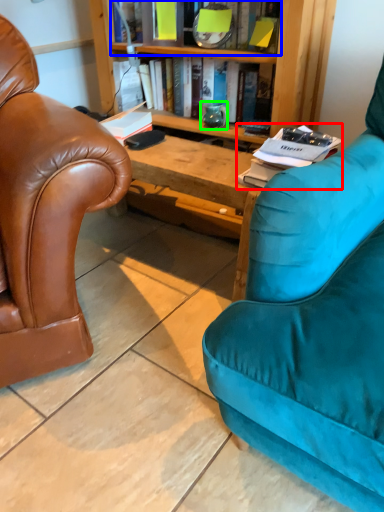
Question: Which object is positioned farthest from book (highlighted by a red box)? Select from book (highlighted by a blue box) and teal (highlighted by a green box).

Choices:
 (A) book
 (B) teal

Answer: (B)